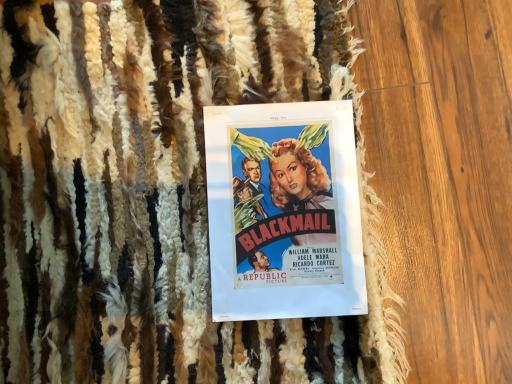
Locate an element on the screen. This screenshot has height=384, width=512. vivid paper poster at center is located at coordinates (284, 211).

What do you see at coordinates (284, 211) in the screenshot? The width and height of the screenshot is (512, 384). I see `vivid paper poster at center` at bounding box center [284, 211].

You are a GUI agent. You are given a task and a screenshot of the screen. Output one action in this format:
    pyautogui.click(x=<x>, y=<y>)
    Task: Click on the vivid paper poster at center
    This screenshot has height=384, width=512.
    Given the screenshot: What is the action you would take?
    pyautogui.click(x=284, y=211)